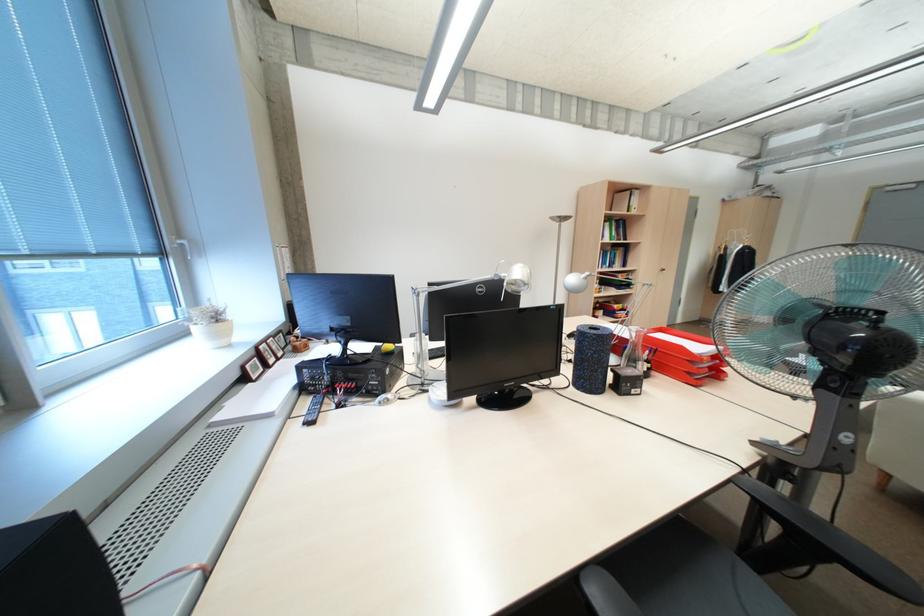
This screenshot has width=924, height=616. I want to click on chair armrest, so coord(818,545).